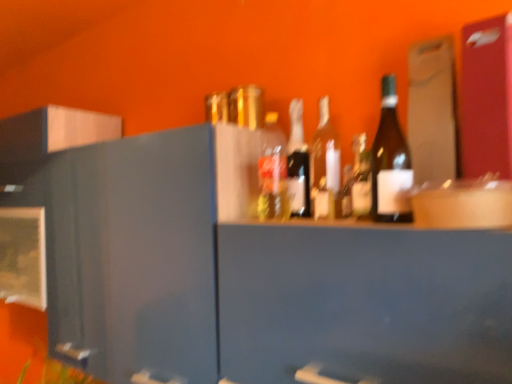
Locate an element on the screen. vacant area in front of translucent glass bottle at center, the 2th bottle in the back-to-front sequence is located at coordinates (292, 225).